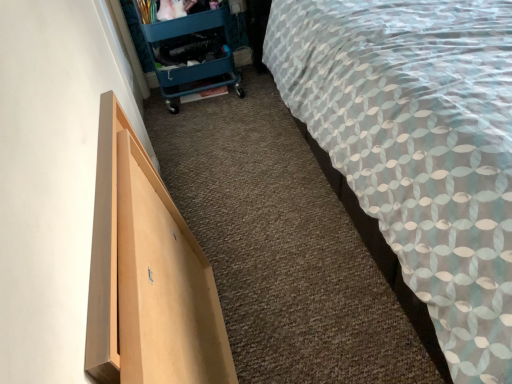
Question: Should I look upward or downward to see light wood drawer at left?

Choices:
 (A) down
 (B) up

Answer: (A)

Question: From a real-world perspective, is patterned fabric bed at right physically above teal plastic trolley at upper left?

Choices:
 (A) yes
 (B) no

Answer: (A)

Question: From a real-world perspective, is patterned fabric bed at right below teal plastic trolley at upper left?

Choices:
 (A) no
 (B) yes

Answer: (A)

Question: Can teal plastic trolley at upper left be found inside patterned fabric bed at right?

Choices:
 (A) yes
 (B) no

Answer: (B)

Question: Can you confirm if patterned fabric bed at right is taller than teal plastic trolley at upper left?

Choices:
 (A) yes
 (B) no

Answer: (A)

Question: Would you say patterned fabric bed at right is outside teal plastic trolley at upper left?

Choices:
 (A) no
 (B) yes

Answer: (B)

Question: Can you confirm if patterned fabric bed at right is positioned to the left of teal plastic trolley at upper left?

Choices:
 (A) yes
 (B) no

Answer: (B)

Question: Can you confirm if light wood drawer at left is taller than patterned fabric bed at right?

Choices:
 (A) no
 (B) yes

Answer: (A)

Question: Can you confirm if light wood drawer at left is shorter than patterned fabric bed at right?

Choices:
 (A) no
 (B) yes

Answer: (B)

Question: From the image's perspective, is light wood drawer at left on top of patterned fabric bed at right?

Choices:
 (A) yes
 (B) no

Answer: (B)

Question: Is light wood drawer at left in front of patterned fabric bed at right?

Choices:
 (A) yes
 (B) no

Answer: (B)

Question: Does light wood drawer at left appear on the right side of patterned fabric bed at right?

Choices:
 (A) no
 (B) yes

Answer: (A)

Question: From a real-world perspective, is light wood drawer at left under patterned fabric bed at right?

Choices:
 (A) no
 (B) yes

Answer: (B)

Question: Does teal plastic trolley at upper left have a greater width compared to patterned fabric bed at right?

Choices:
 (A) no
 (B) yes

Answer: (A)